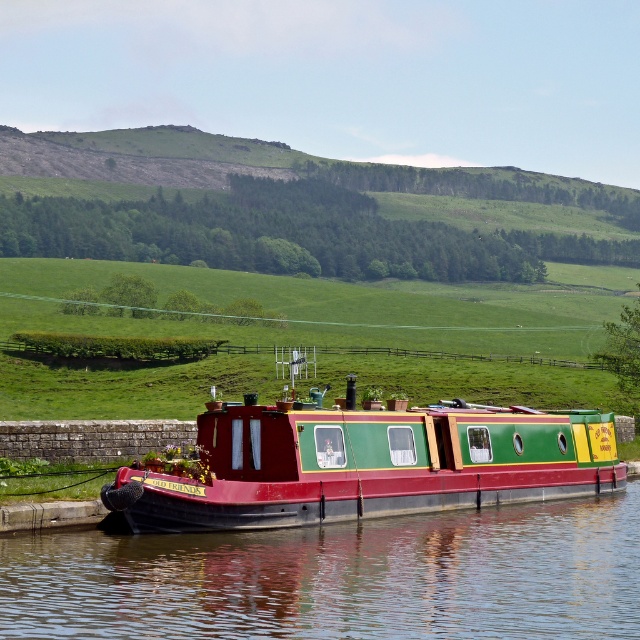
Question: Which of the following is the farthest from the observer?

Choices:
 (A) smooth dark water at center
 (B) matte green and red boat at center

Answer: (B)

Question: Does smooth dark water at center appear on the right side of matte green and red boat at center?

Choices:
 (A) yes
 (B) no

Answer: (A)

Question: Is smooth dark water at center to the right of matte green and red boat at center from the viewer's perspective?

Choices:
 (A) yes
 (B) no

Answer: (A)

Question: Is the position of smooth dark water at center less distant than that of matte green and red boat at center?

Choices:
 (A) no
 (B) yes

Answer: (B)